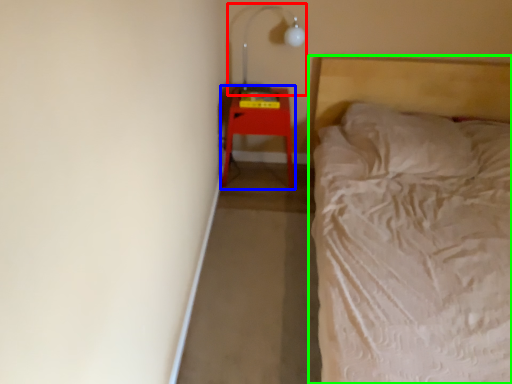
Question: Based on their relative distances, which object is farther from lamp (highlighted by a red box)? Choose from furniture (highlighted by a blue box) and bed (highlighted by a green box).

Choices:
 (A) furniture
 (B) bed

Answer: (B)